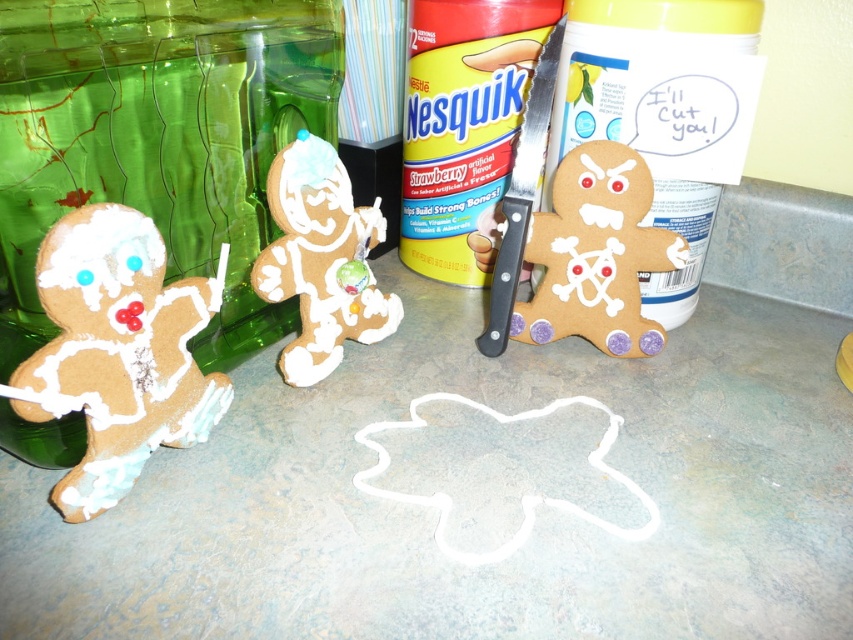
Question: Is white sugar-coated gingerbread man at left closer to camera compared to white frosted gingerbread man at center?

Choices:
 (A) yes
 (B) no

Answer: (A)

Question: In this image, where is brown cardboard gingerbread man at center right located relative to white frosted gingerbread man at center?

Choices:
 (A) left
 (B) right

Answer: (B)

Question: Which point is farther to the camera?

Choices:
 (A) (596, 161)
 (B) (65, 221)

Answer: (A)

Question: Can you confirm if brown cardboard gingerbread man at center right is smaller than white frosted gingerbread man at center?

Choices:
 (A) yes
 (B) no

Answer: (B)

Question: Which point is farther to the camera?

Choices:
 (A) click(x=556, y=170)
 (B) click(x=91, y=515)

Answer: (A)

Question: Which point appears closest to the camera in this image?

Choices:
 (A) (119, 344)
 (B) (355, 230)

Answer: (A)